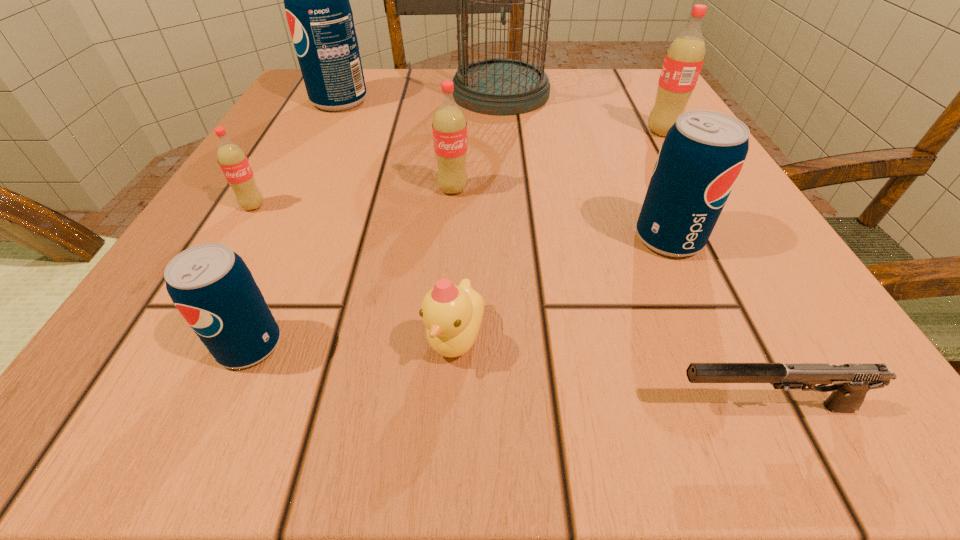
This screenshot has width=960, height=540. Identify the location of free point between the biggest red soda and the second biggest red soda. tap(558, 160).

The width and height of the screenshot is (960, 540). Identify the location of free space between the farthest blue pop and the nearest blue pop. (295, 223).

Image resolution: width=960 pixels, height=540 pixels. I want to click on blank region between the smallest red soda and the gun, so click(510, 306).

What are the coordinates of `vacant space that is in between the rightmost red soda and the birdcage` in the screenshot? It's located at (581, 112).

Where is `free spot between the yellow duckling and the second smallest red soda`? The height and width of the screenshot is (540, 960). free spot between the yellow duckling and the second smallest red soda is located at coordinates (454, 264).

Find the location of a particular element. the closest object to the duckling is located at coordinates (211, 286).

Locate which object is the fourth closest to the farthest blue pop. Please provide its 2D coordinates. Your answer should be formatted as a tuple, i.e. [(x, y)], where the tuple contains the x and y coordinates of a point satisfying the conditions above.

[(211, 286)]

Choose which soda is the sixth nearest neighbor to the yellow duckling. Please provide its 2D coordinates. Your answer should be formatted as a tuple, i.e. [(x, y)], where the tuple contains the x and y coordinates of a point satisfying the conditions above.

[(319, 15)]

Choose which soda is the fifth nearest neighbor to the sixth nearest object. Please provide its 2D coordinates. Your answer should be formatted as a tuple, i.e. [(x, y)], where the tuple contains the x and y coordinates of a point satisfying the conditions above.

[(684, 59)]

Identify the location of blue pop object that ranks as the second closest to the second biggest blue pop. Image resolution: width=960 pixels, height=540 pixels. (319, 15).